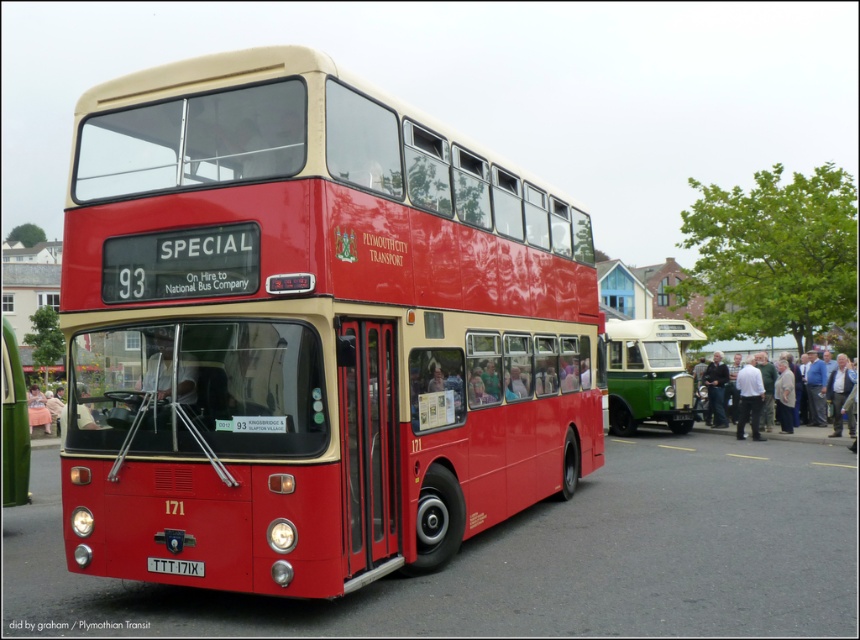
Which bus is wider, the matte red bus at center or the green polished wood bus at center?

The green polished wood bus at center is wider than the matte red bus at center.